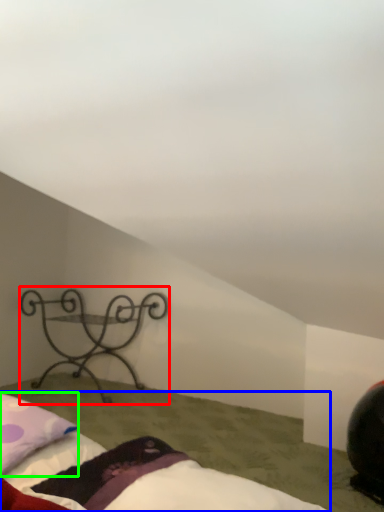
Question: Based on their relative distances, which object is nearer to furniture (highlighted by a red box)? Choose from bed (highlighted by a blue box) and pillow (highlighted by a green box).

Choices:
 (A) bed
 (B) pillow

Answer: (B)